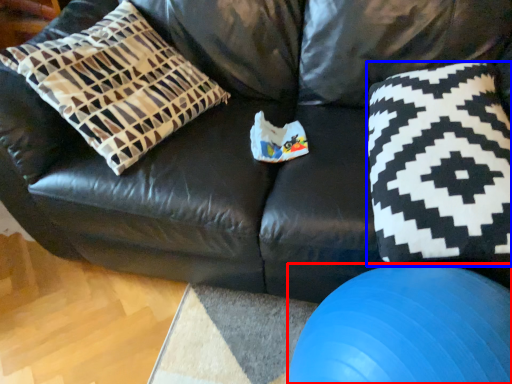
Question: Which object appears closest to the camera in this image, ball (highlighted by a red box) or throw pillow (highlighted by a blue box)?

Choices:
 (A) ball
 (B) throw pillow

Answer: (A)